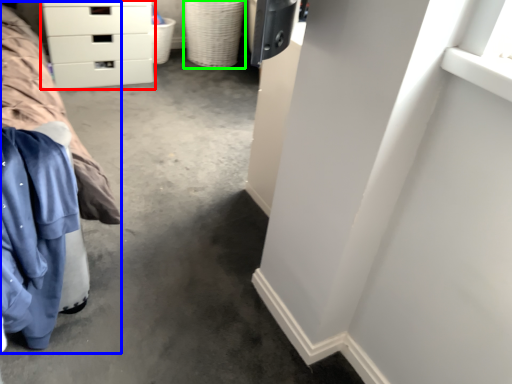
Question: Considering the real-world distances, which object is closest to chest of drawers (highlighted by a red box)? bed (highlighted by a blue box) or basket (highlighted by a green box).

Choices:
 (A) bed
 (B) basket

Answer: (B)